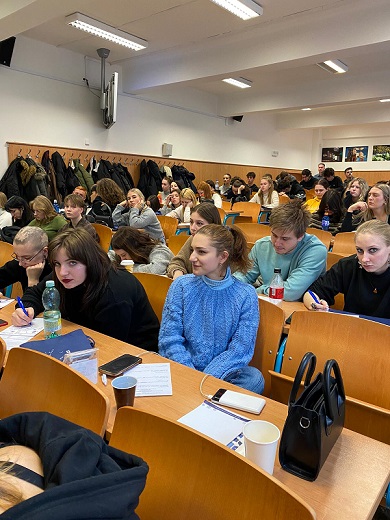
You are a GUI agent. You are given a task and a screenshot of the screen. Output one action in this format:
    pyautogui.click(x=<x>, y=<y>)
    Task: Click on the cups
    The height and width of the screenshot is (520, 390).
    Given the screenshot: What is the action you would take?
    pyautogui.click(x=266, y=445), pyautogui.click(x=122, y=386), pyautogui.click(x=125, y=261)